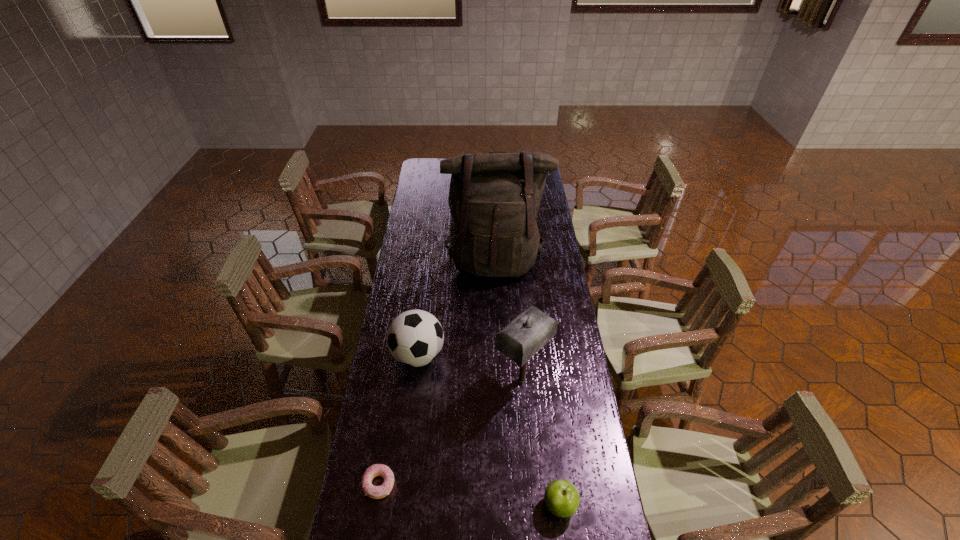
What are the coordinates of `vacant region located on the right of the shortest object` in the screenshot? It's located at (517, 483).

You are a GUI agent. You are given a task and a screenshot of the screen. Output one action in this format:
    pyautogui.click(x=<x>, y=<y>)
    Task: Click on the soccer ball located at the left edge
    This screenshot has height=540, width=960.
    Given the screenshot: What is the action you would take?
    pyautogui.click(x=415, y=338)

Find the location of `doughnut situated at the left edge`. doughnut situated at the left edge is located at coordinates (376, 492).

Find the location of a particular element. backpack present at the right edge is located at coordinates (494, 198).

Identify the location of mallet located in the right edge section of the desktop. The image size is (960, 540). (524, 336).

This screenshot has height=540, width=960. In order to click on apple that is at the right edge in this screenshot , I will do `click(561, 497)`.

In order to click on vacant space at the left edge in this screenshot , I will do `click(375, 527)`.

This screenshot has height=540, width=960. Find the location of `vacant area at the right edge of the desktop`. vacant area at the right edge of the desktop is located at coordinates (581, 515).

Where is `unoccupied area between the backpack and the doughnut`? The image size is (960, 540). unoccupied area between the backpack and the doughnut is located at coordinates (437, 373).

Find the location of a particular element. Image resolution: width=960 pixels, height=540 pixels. vacant space that's between the shortest object and the soccer ball is located at coordinates (398, 419).